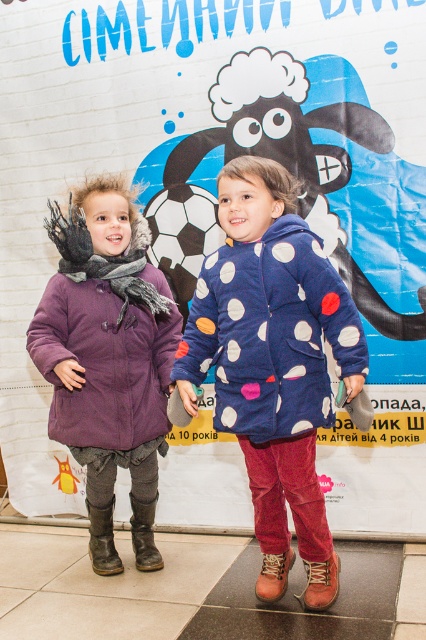
Question: Which point is farther to the camera?

Choices:
 (A) brown leather boot at lower left
 (B) purple corduroy jacket at left

Answer: (A)

Question: Among these objects, which one is farthest from the camera?

Choices:
 (A) purple quilted coat at left
 (B) leather boot at lower left
 (C) brown leather boot at lower left

Answer: (B)

Question: Which object is the closest to the brown leather boot at lower left?

Choices:
 (A) leather boot at lower left
 (B) purple corduroy jacket at left
 (C) blue fleece jacket at center
 (D) purple quilted coat at left

Answer: (A)

Question: Is blue fleece jacket at center thinner than leather boot at lower left?

Choices:
 (A) no
 (B) yes

Answer: (A)

Question: Is purple corduroy jacket at left behind brown suede boot at lower center?

Choices:
 (A) no
 (B) yes

Answer: (B)

Question: Can you confirm if purple quilted coat at left is positioned above blue fleece jacket at center?

Choices:
 (A) no
 (B) yes

Answer: (A)